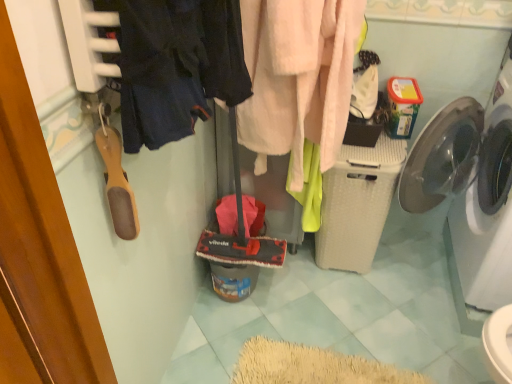
Question: Is fuzzy pink towel at center, placed as the second clothing when sorted from left to right, bigger or smaller than wooden shoe at left?

Choices:
 (A) small
 (B) big

Answer: (B)

Question: Is fuzzy pink towel at center, placed as the first clothing when sorted from right to left, to the left or to the right of wooden shoe at left in the image?

Choices:
 (A) left
 (B) right

Answer: (B)

Question: Which of these objects is positioned closest to the white plastic washing machine at right, positioned as the 2th washing machine in left-to-right order?

Choices:
 (A) dark blue fabric at upper left, the 2th clothing positioned from the back
 (B) white textured laundry basket at center-right, which ranks as the second washing machine in right-to-left order
 (C) fuzzy pink towel at center, positioned as the first clothing in back-to-front order
 (D) wooden shoe at left

Answer: (B)

Question: Estimate the real-world distances between objects in this image. Which object is closer to the wooden shoe at left?

Choices:
 (A) fuzzy pink towel at center, positioned as the first clothing in back-to-front order
 (B) white plastic washing machine at right, positioned as the 2th washing machine in left-to-right order
 (C) white textured laundry basket at center-right, which ranks as the second washing machine in right-to-left order
 (D) dark blue fabric at upper left, the first clothing viewed from the front

Answer: (D)